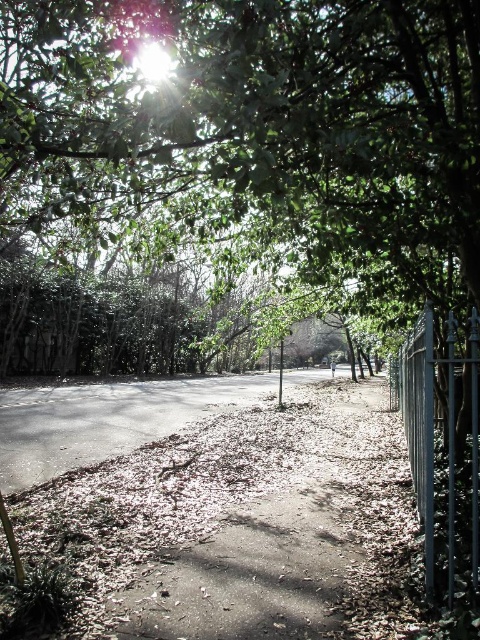
You are walking along the pathway in the scene and want to take a photo of the green leafy tree at center and the metallic silver fence at right. Which object should you focus on first if you want both to be in the same frame without moving the camera?

You should focus on the green leafy tree at center first because it is positioned on the left side of the metallic silver fence at right, so keeping both in frame requires starting from the left side.

From the picture: You are standing at the entrance of the pathway and want to walk straight towards the green leafy tree at center. Will you stay on the pathway the entire time?

Yes, because the green leafy tree at center is located at point (x=256, y=128), which is directly along the pathway you are walking on.